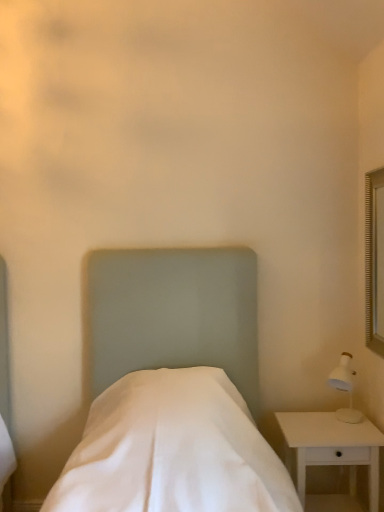
Describe the element at coordinates (173, 389) in the screenshot. Image resolution: width=384 pixels, height=512 pixels. I see `white fabric bed at center` at that location.

Identify the location of white fabric bed at center. (173, 389).

At what (x,y) coordinates should I click in order to perform the action: click on white wood nightstand at lower right. Please return your answer as a coordinate pair (x, y). The width and height of the screenshot is (384, 512). Looking at the image, I should click on (330, 455).

The height and width of the screenshot is (512, 384). Describe the element at coordinates (330, 455) in the screenshot. I see `white wood nightstand at lower right` at that location.

In order to click on white fabric bed at center in this screenshot , I will do `click(173, 389)`.

Does white fabric bed at center appear on the left side of white wood nightstand at lower right?

Correct, you'll find white fabric bed at center to the left of white wood nightstand at lower right.

Which is in front, white fabric bed at center or white wood nightstand at lower right?

white fabric bed at center is closer to the camera.

Between point (105, 318) and point (303, 439), which one is positioned behind?

The point (105, 318) is farther.

From the image's perspective, which is below, white fabric bed at center or white wood nightstand at lower right?

white wood nightstand at lower right appears lower in the image.

From a real-world perspective, which object stands above the other?

white fabric bed at center.

Considering the sizes of white fabric bed at center and white wood nightstand at lower right in the image, is white fabric bed at center wider or thinner than white wood nightstand at lower right?

white fabric bed at center is wider than white wood nightstand at lower right.

Who is shorter, white fabric bed at center or white wood nightstand at lower right?

white wood nightstand at lower right.

Which of these two, white fabric bed at center or white wood nightstand at lower right, is smaller?

white wood nightstand at lower right is smaller.

In the scene shown: Does white fabric bed at center contain white wood nightstand at lower right?

Actually, white wood nightstand at lower right is outside white fabric bed at center.

Does white fabric bed at center touch white wood nightstand at lower right?

white fabric bed at center and white wood nightstand at lower right are not in contact.

From the picture: Is white fabric bed at center turned away from white wood nightstand at lower right?

white fabric bed at center is not turned away from white wood nightstand at lower right.

Where is `bed on the left of the white wood nightstand at lower right`? The width and height of the screenshot is (384, 512). bed on the left of the white wood nightstand at lower right is located at coordinates (173, 389).

Can you confirm if white wood nightstand at lower right is positioned to the left of white fabric bed at center?

Incorrect, white wood nightstand at lower right is not on the left side of white fabric bed at center.

Is white wood nightstand at lower right in front of or behind white fabric bed at center in the image?

Visually, white wood nightstand at lower right is located behind white fabric bed at center.

Does point (305, 434) come farther from viewer compared to point (263, 460)?

Yes.

From the image's perspective, is white wood nightstand at lower right beneath white fabric bed at center?

Yes.

From a real-world perspective, is white wood nightstand at lower right under white fabric bed at center?

Yes.

Is white wood nightstand at lower right thinner than white fabric bed at center?

Yes.

Who is shorter, white wood nightstand at lower right or white fabric bed at center?

With less height is white wood nightstand at lower right.

Who is smaller, white wood nightstand at lower right or white fabric bed at center?

white wood nightstand at lower right is smaller.

Is white fabric bed at center completely or partially inside white wood nightstand at lower right?

No, white fabric bed at center is located outside of white wood nightstand at lower right.

Is white wood nightstand at lower right not near white fabric bed at center?

No, white wood nightstand at lower right is not far away from white fabric bed at center.

Is white wood nightstand at lower right turned away from white fabric bed at center?

No, white wood nightstand at lower right's orientation is not away from white fabric bed at center.

Consider the image. What's the angular difference between white wood nightstand at lower right and white fabric bed at center's facing directions?

There is a 1.49-degree angle between the facing directions of white wood nightstand at lower right and white fabric bed at center.

How distant is white wood nightstand at lower right from white fabric bed at center?

21.06 inches.

Locate an element on the screen. Image resolution: width=384 pixels, height=512 pixels. nightstand that appears below the white fabric bed at center (from the image's perspective) is located at coordinates [x=330, y=455].

Locate an element on the screen. bed above the white wood nightstand at lower right (from the image's perspective) is located at coordinates pos(173,389).

At what (x,y) coordinates should I click in order to perform the action: click on bed on the left of white wood nightstand at lower right. Please return your answer as a coordinate pair (x, y). Looking at the image, I should click on (173, 389).